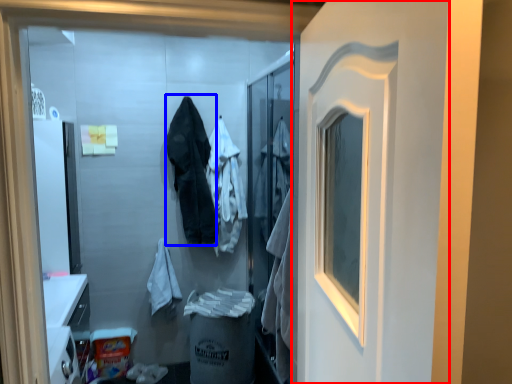
Question: Which point is closer to the camera, door (highlighted by a red box) or clothing (highlighted by a blue box)?

Choices:
 (A) door
 (B) clothing

Answer: (A)